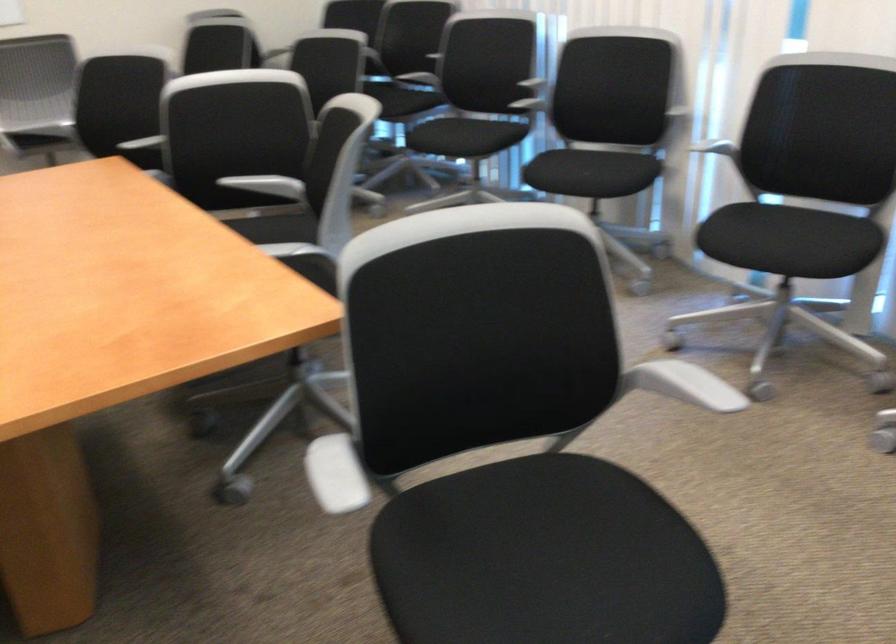
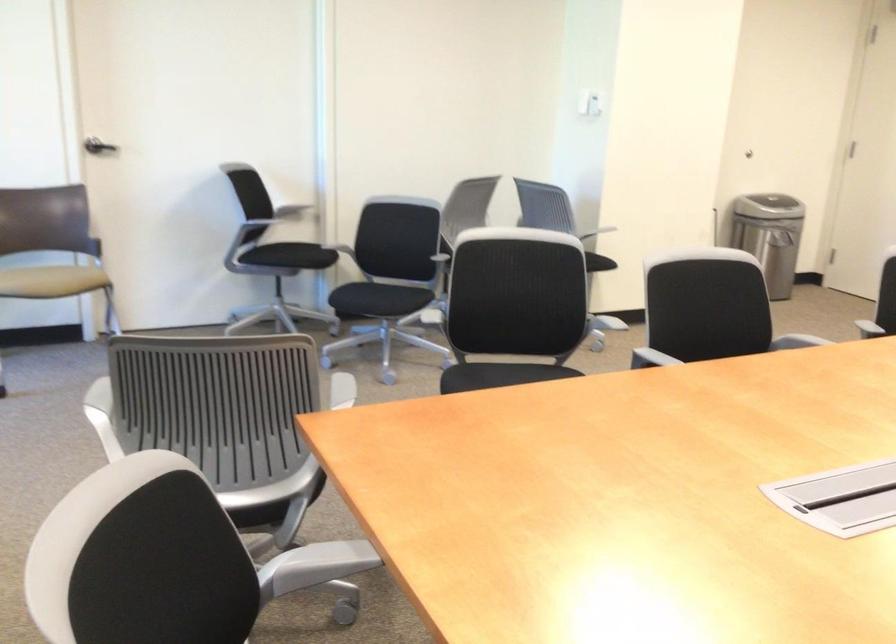
Where in the second image is the point corresponding to point (230, 249) from the first image?

(320, 562)